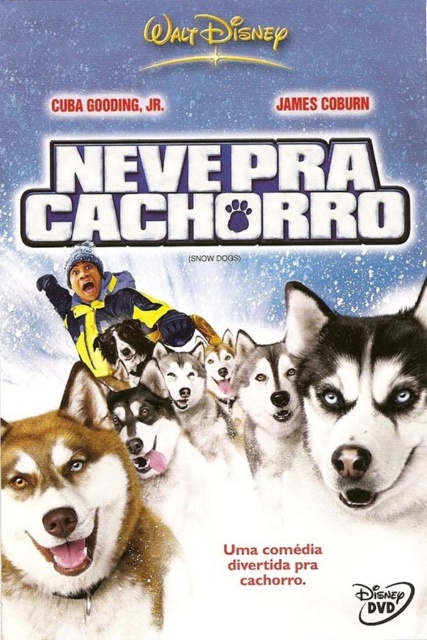
You are looking at the DVD cover of the movie NEVE PRA CACHORRO. There are two points on the cover located at coordinates point (14,426) and point (366,451). Which point is closer to you?

Point (14,426) is further to the camera than point (366,451). Therefore, point (366,451) is closer to you.

You are designing a poster for the movie and need to place a sticker on the DVD cover. The sticker must be placed between the shiny brown fur at center and the sleek fur husky at center. Considering their widths, which one should the sticker be closer to?

The sticker should be closer to the sleek fur husky at center because the shiny brown fur at center is wider, so placing the sticker closer to the narrower husky ensures the sticker is centered between them.